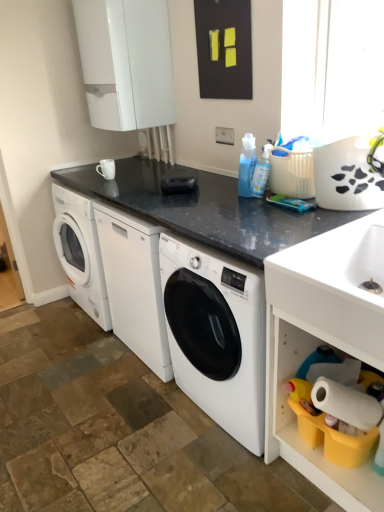
Question: Are white plastic shelf at lower right and blue glossy bottle at center far apart?

Choices:
 (A) no
 (B) yes

Answer: (A)

Question: Can you confirm if white plastic shelf at lower right is thinner than blue glossy bottle at center?

Choices:
 (A) no
 (B) yes

Answer: (A)

Question: Does white plastic shelf at lower right have a smaller size compared to blue glossy bottle at center?

Choices:
 (A) yes
 (B) no

Answer: (B)

Question: From the image's perspective, does white plastic shelf at lower right appear lower than blue glossy bottle at center?

Choices:
 (A) yes
 (B) no

Answer: (A)

Question: From the image's perspective, does white plastic shelf at lower right appear higher than blue glossy bottle at center?

Choices:
 (A) no
 (B) yes

Answer: (A)

Question: From the image's perspective, is white plastic shelf at lower right above or below white glossy sink at lower right?

Choices:
 (A) above
 (B) below

Answer: (B)

Question: Considering the positions of point (271, 442) and point (286, 297), is point (271, 442) closer or farther from the camera than point (286, 297)?

Choices:
 (A) farther
 (B) closer

Answer: (A)

Question: Would you say white plastic shelf at lower right is to the left or to the right of white glossy sink at lower right in the picture?

Choices:
 (A) right
 (B) left

Answer: (A)

Question: From a real-world perspective, is white plastic shelf at lower right physically located above or below white glossy sink at lower right?

Choices:
 (A) below
 (B) above

Answer: (A)

Question: Does point (248, 190) appear closer or farther from the camera than point (316, 256)?

Choices:
 (A) closer
 (B) farther

Answer: (B)

Question: Is blue glossy bottle at center inside the boundaries of white glossy sink at lower right, or outside?

Choices:
 (A) outside
 (B) inside

Answer: (A)

Question: From the image's perspective, relative to white glossy sink at lower right, is blue glossy bottle at center above or below?

Choices:
 (A) above
 (B) below

Answer: (A)

Question: Is blue glossy bottle at center taller or shorter than white glossy sink at lower right?

Choices:
 (A) tall
 (B) short

Answer: (A)

Question: From a real-world perspective, is white plastic shelf at lower right above or below blue glossy bottle at center?

Choices:
 (A) below
 (B) above

Answer: (A)

Question: Is white plastic shelf at lower right inside or outside of blue glossy bottle at center?

Choices:
 (A) outside
 (B) inside

Answer: (A)